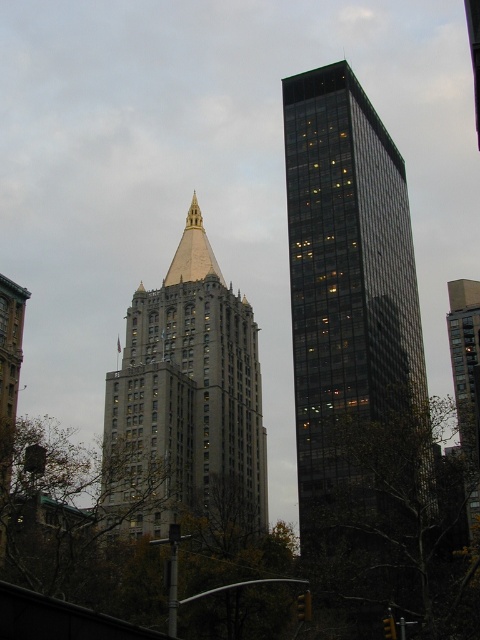
Does gray stone building at center appear on the right side of gold/brass spire at center?

Yes, gray stone building at center is to the right of gold/brass spire at center.

Can you confirm if gray stone building at center is wider than gold/brass spire at center?

Indeed, gray stone building at center has a greater width compared to gold/brass spire at center.

Identify the location of gray stone building at center. This screenshot has height=640, width=480. (186, 403).

Between dark glass skyscraper at right and gray stone building at center, which one has less height?

gray stone building at center

Who is positioned more to the right, dark glass skyscraper at right or gray stone building at center?

From the viewer's perspective, dark glass skyscraper at right appears more on the right side.

I want to click on dark glass skyscraper at right, so click(x=346, y=289).

Measure the distance between point (308, 394) and camera.

Point (308, 394) and camera are 260.39 feet apart from each other.

The height and width of the screenshot is (640, 480). Find the location of `dark glass skyscraper at right`. dark glass skyscraper at right is located at coordinates (346, 289).